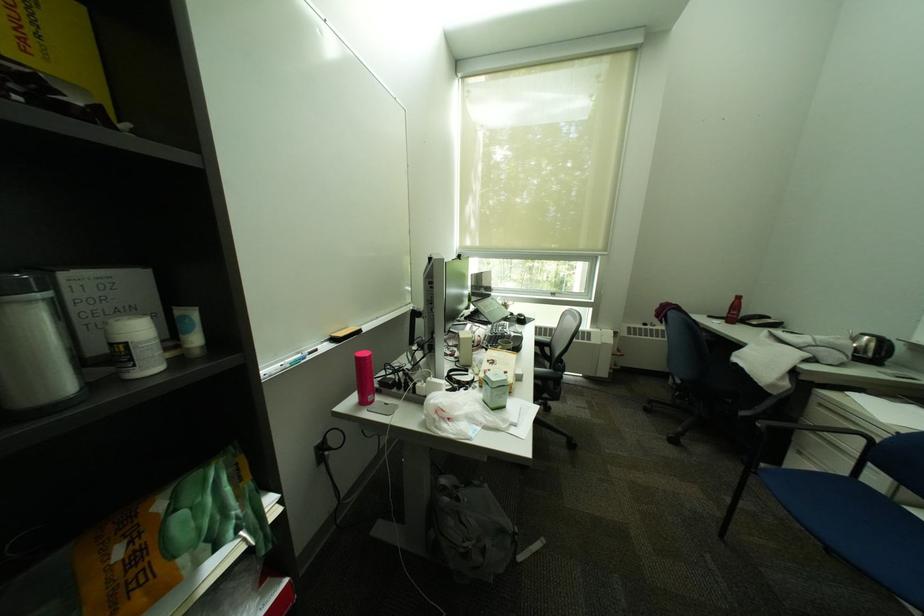
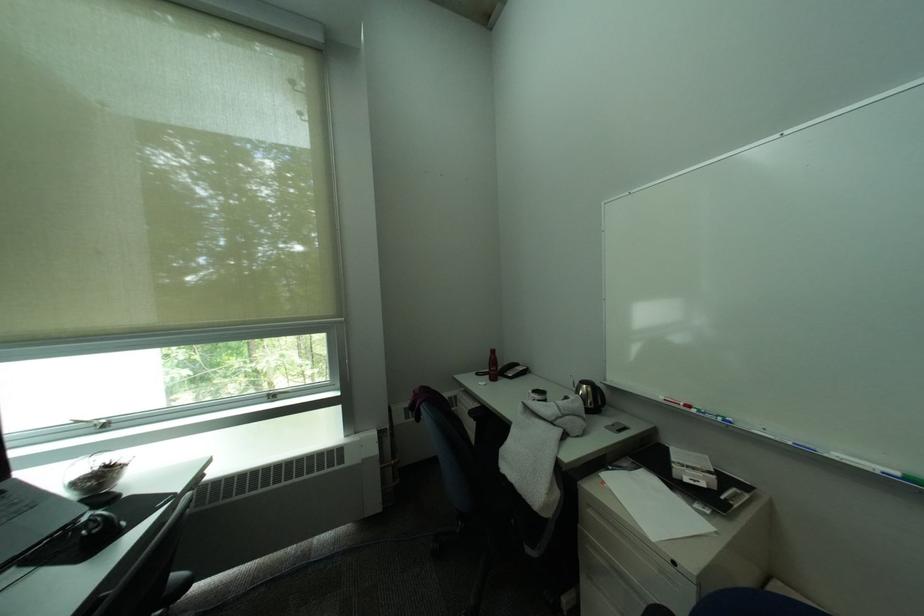
The point at (720, 318) is marked in the first image. Where is the corresponding point in the second image?

(488, 376)